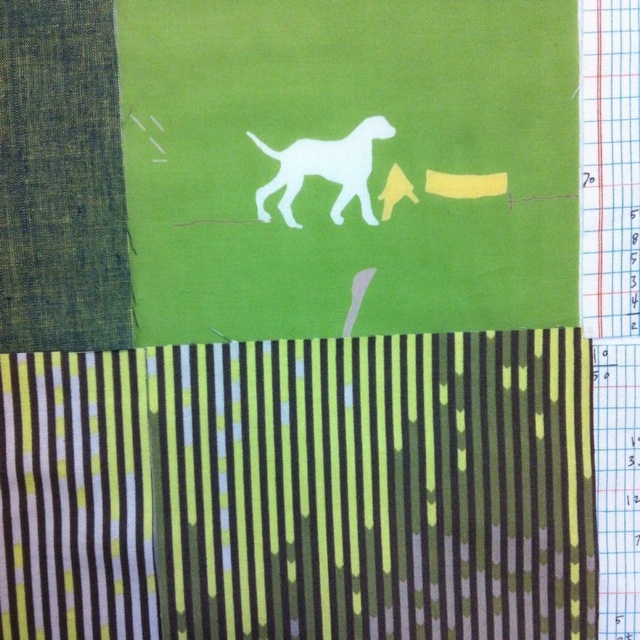
You are an artist working on a collage. You have a green striped fabric at lower center. Where exactly should you place it on your canvas to match the original image?

Place the green striped fabric at lower center at the coordinates point (300, 490) to match the original image.

You are an artist trying to arrange the green striped fabric at lower center and the white paper dog at center on a shelf. If you want to place the taller object on the bottom shelf and the shorter one on the top shelf, which object should go where?

The white paper dog at center is taller than the green striped fabric at lower center, so place the white paper dog at center on the bottom shelf and the green striped fabric at lower center on the top shelf.

You are an artist working on a collage. You have two dogs in your design, a white paper dog at center and a white matte dog at center. Which one should you choose if you want the dog to stand out more in the collage?

The white paper dog at center is larger in size than the white matte dog at center, so choosing the white paper dog at center would make it stand out more due to its larger size.